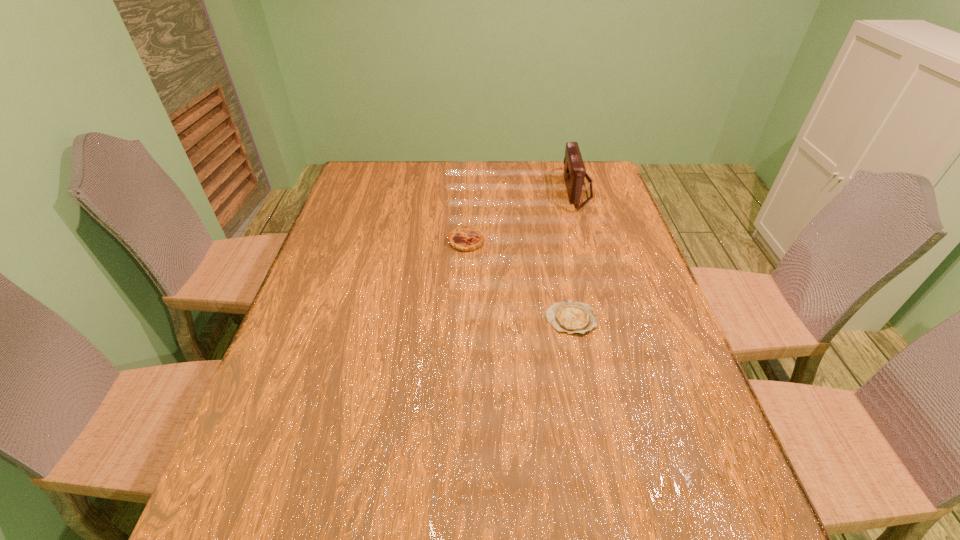
Find the location of `free space between the farther quiche and the farthest object`. free space between the farther quiche and the farthest object is located at coordinates (521, 215).

Find the location of a particular element. The height and width of the screenshot is (540, 960). vacant space that is in between the tallest object and the taller quiche is located at coordinates (521, 215).

Where is `vacant area between the tallest object and the second object from left to right`? The height and width of the screenshot is (540, 960). vacant area between the tallest object and the second object from left to right is located at coordinates (574, 254).

Locate an element on the screen. The width and height of the screenshot is (960, 540). free space between the shoulder bag and the second object from right to left is located at coordinates (574, 254).

The width and height of the screenshot is (960, 540). Identify the location of unoccupied area between the right quiche and the tallest object. (574, 254).

Where is `vacant space that's between the rightmost object and the taller quiche`? This screenshot has width=960, height=540. vacant space that's between the rightmost object and the taller quiche is located at coordinates (521, 215).

The image size is (960, 540). I want to click on free space between the second farthest object and the second object from left to right, so click(x=518, y=280).

The height and width of the screenshot is (540, 960). What are the coordinates of `free space between the shortest object and the shoulder bag` in the screenshot? It's located at (574, 254).

Locate an element on the screen. This screenshot has height=540, width=960. the closest object to the taller quiche is located at coordinates [571, 317].

The image size is (960, 540). I want to click on object that ranks as the closest to the farthest object, so click(464, 238).